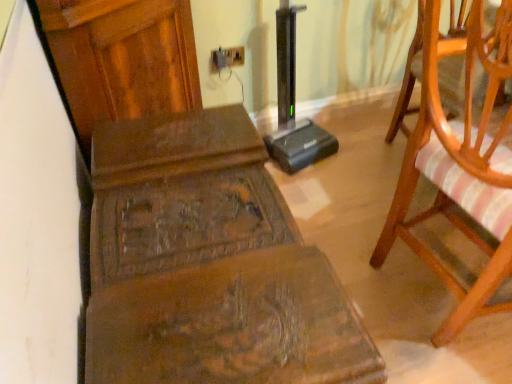
Question: Is wooden chair with striped cushion at right not inside matte plastic electric outlet at upper center?

Choices:
 (A) yes
 (B) no

Answer: (A)

Question: From the image's perspective, would you say wooden chair with striped cushion at right is shown under matte plastic electric outlet at upper center?

Choices:
 (A) no
 (B) yes

Answer: (B)

Question: Considering the relative sizes of wooden chair with striped cushion at right and matte plastic electric outlet at upper center in the image provided, is wooden chair with striped cushion at right bigger than matte plastic electric outlet at upper center?

Choices:
 (A) yes
 (B) no

Answer: (A)

Question: Does wooden chair with striped cushion at right have a lesser width compared to matte plastic electric outlet at upper center?

Choices:
 (A) yes
 (B) no

Answer: (B)

Question: Is wooden chair with striped cushion at right wider than matte plastic electric outlet at upper center?

Choices:
 (A) no
 (B) yes

Answer: (B)

Question: Considering their positions, is wooden carved bench at center located in front of or behind matte plastic electric outlet at upper center?

Choices:
 (A) front
 (B) behind

Answer: (A)

Question: Looking at their shapes, would you say wooden carved bench at center is wider or thinner than matte plastic electric outlet at upper center?

Choices:
 (A) wide
 (B) thin

Answer: (A)

Question: Is point (192, 261) positioned closer to the camera than point (233, 51)?

Choices:
 (A) closer
 (B) farther

Answer: (A)

Question: Considering the relative positions of wooden carved bench at center and matte plastic electric outlet at upper center in the image provided, is wooden carved bench at center to the left or to the right of matte plastic electric outlet at upper center?

Choices:
 (A) right
 (B) left

Answer: (B)

Question: Is wooden chair with striped cushion at right bigger or smaller than wooden carved bench at center?

Choices:
 (A) small
 (B) big

Answer: (B)

Question: From a real-world perspective, relative to wooden carved bench at center, is wooden chair with striped cushion at right vertically above or below?

Choices:
 (A) above
 (B) below

Answer: (A)

Question: Is wooden chair with striped cushion at right wider or thinner than wooden carved bench at center?

Choices:
 (A) thin
 (B) wide

Answer: (B)

Question: Is wooden chair with striped cushion at right inside or outside of wooden carved bench at center?

Choices:
 (A) inside
 (B) outside

Answer: (B)

Question: From a real-world perspective, is matte plastic electric outlet at upper center above or below wooden carved bench at center?

Choices:
 (A) above
 (B) below

Answer: (A)

Question: Is point (224, 51) closer or farther from the camera than point (181, 374)?

Choices:
 (A) farther
 (B) closer

Answer: (A)